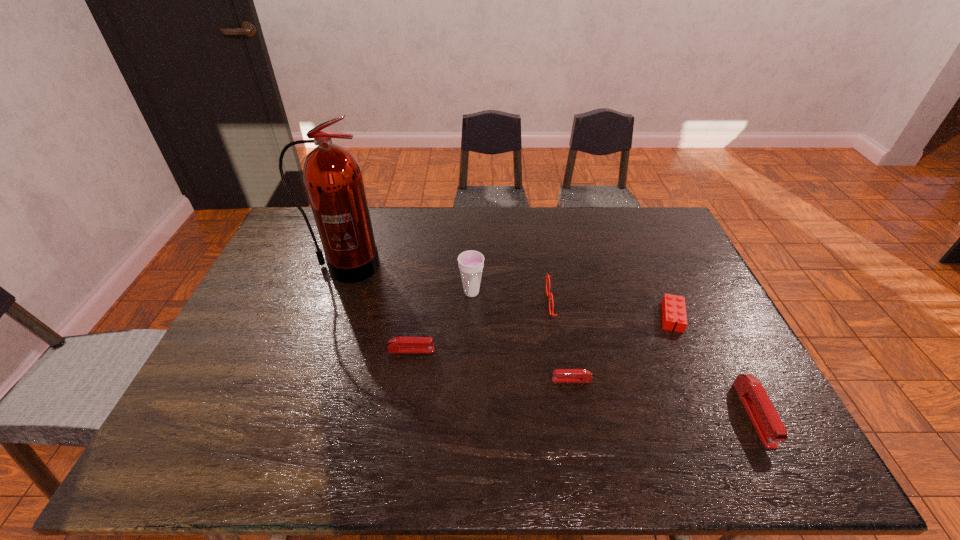
Locate an element on the screen. This screenshot has width=960, height=540. vacant space located on the front-facing side of the spectacles is located at coordinates (492, 303).

Find the location of a particular element. The image size is (960, 540). object that is at the near edge is located at coordinates (769, 426).

Image resolution: width=960 pixels, height=540 pixels. I want to click on object that is positioned at the left edge, so pos(333,179).

Identify the location of stapler present at the right edge. (769, 426).

This screenshot has height=540, width=960. I want to click on Lego present at the right edge, so click(673, 307).

The height and width of the screenshot is (540, 960). Identify the location of object at the near right corner. (769, 426).

This screenshot has height=540, width=960. I want to click on vacant space at the far edge of the desktop, so click(527, 242).

Locate an element on the screen. vacant space at the near edge of the desktop is located at coordinates (257, 410).

Locate an element on the screen. This screenshot has width=960, height=540. vacant space at the left edge is located at coordinates (250, 377).

You are a GUI agent. You are given a task and a screenshot of the screen. Output one action in this format:
    pyautogui.click(x=<x>, y=<y>)
    Task: Click on the vacant space at the right edge of the desktop
    The height and width of the screenshot is (540, 960).
    Given the screenshot: What is the action you would take?
    pyautogui.click(x=743, y=360)